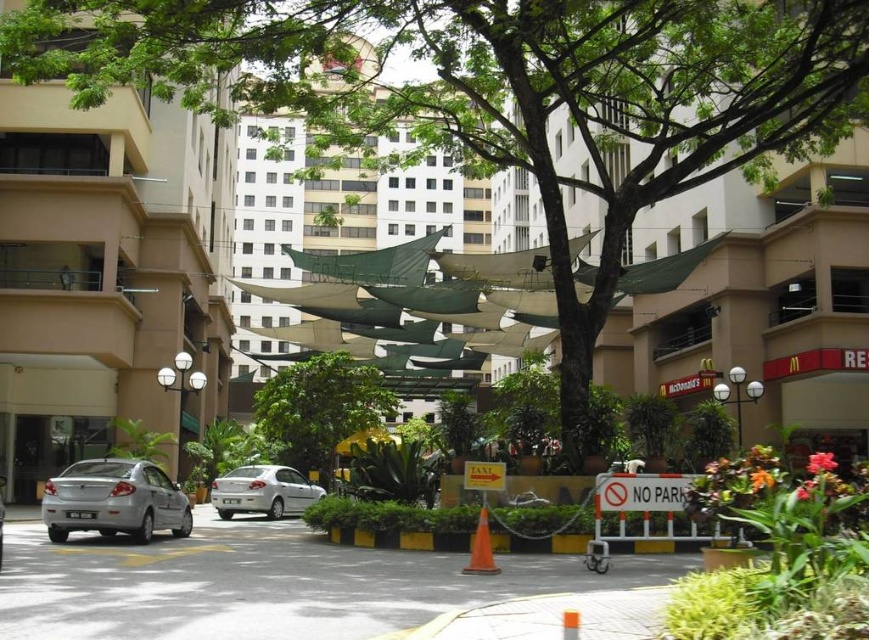
Between green leafy tree at center and silver metallic sedan at center, which one appears on the right side from the viewer's perspective?

→ silver metallic sedan at center

Does green leafy tree at center have a smaller size compared to silver metallic sedan at center?

No, green leafy tree at center is not smaller than silver metallic sedan at center.

Find the location of a particular element. The image size is (869, 640). green leafy tree at center is located at coordinates click(319, 408).

What do you see at coordinates (105, 272) in the screenshot?
I see `beige concrete building at left` at bounding box center [105, 272].

Can you confirm if beige concrete building at left is positioned to the right of green leafy tree at center?

Incorrect, beige concrete building at left is not on the right side of green leafy tree at center.

Which is behind, point (50, 461) or point (345, 388)?

The point (345, 388) is behind.

Locate an element on the screen. This screenshot has width=869, height=640. beige concrete building at left is located at coordinates (105, 272).

Image resolution: width=869 pixels, height=640 pixels. What are the coordinates of `silver metallic car at lower left` in the screenshot? It's located at (114, 500).

Which is more to the left, silver metallic car at lower left or silver metallic sedan at center?

silver metallic car at lower left

Find the location of a particular element. This screenshot has height=640, width=869. silver metallic car at lower left is located at coordinates (114, 500).